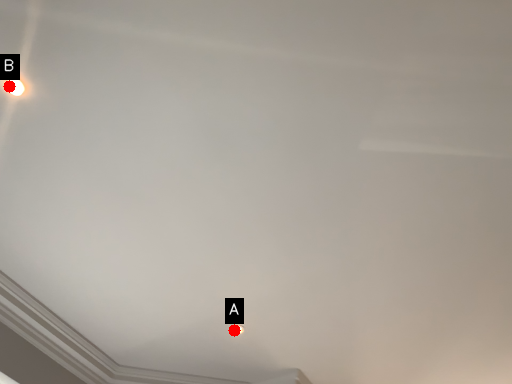
Question: Two points are circled on the image, labeled by A and B beside each circle. Which point is closer to the camera?

Choices:
 (A) A is closer
 (B) B is closer

Answer: (B)